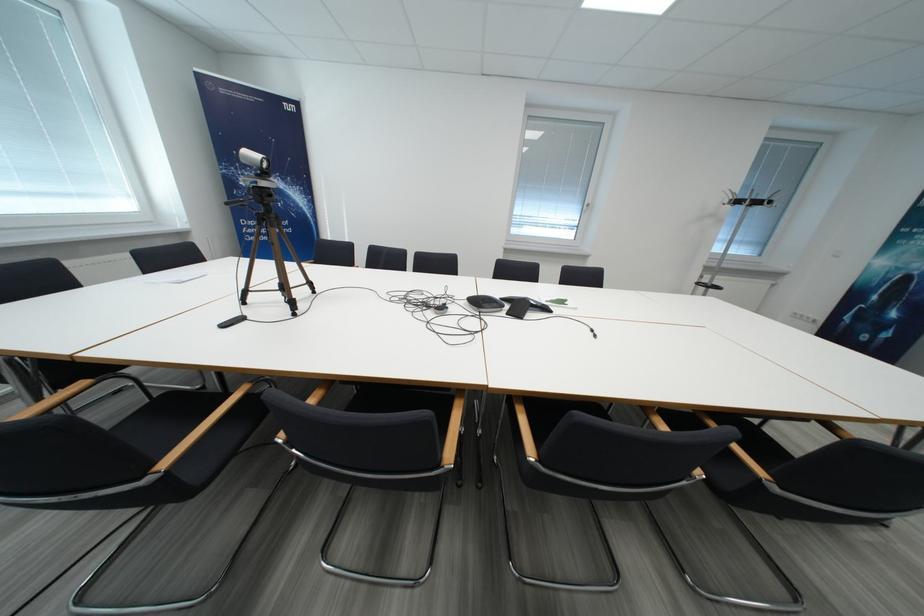
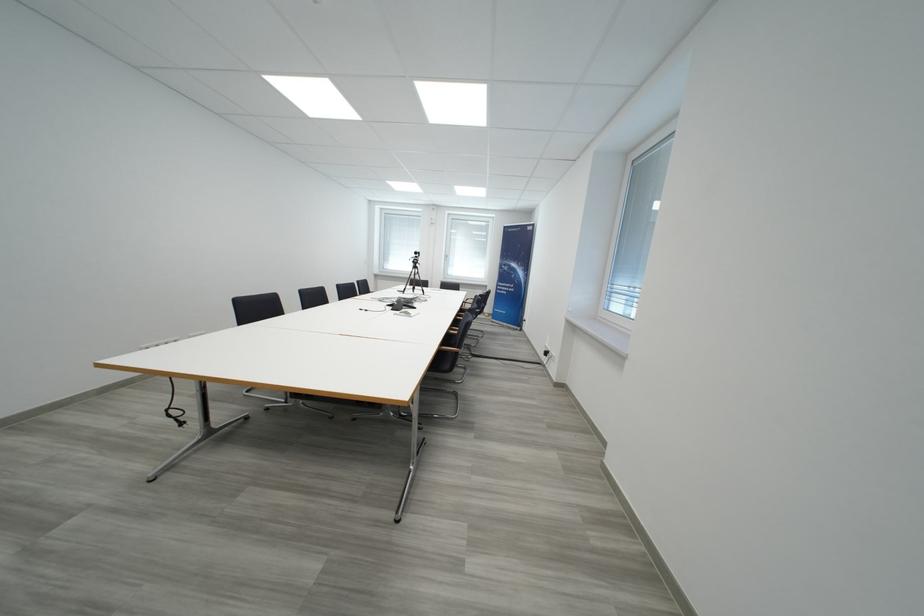
Where in the second image is the point corresponding to [529,321] from the first image?

(395, 309)